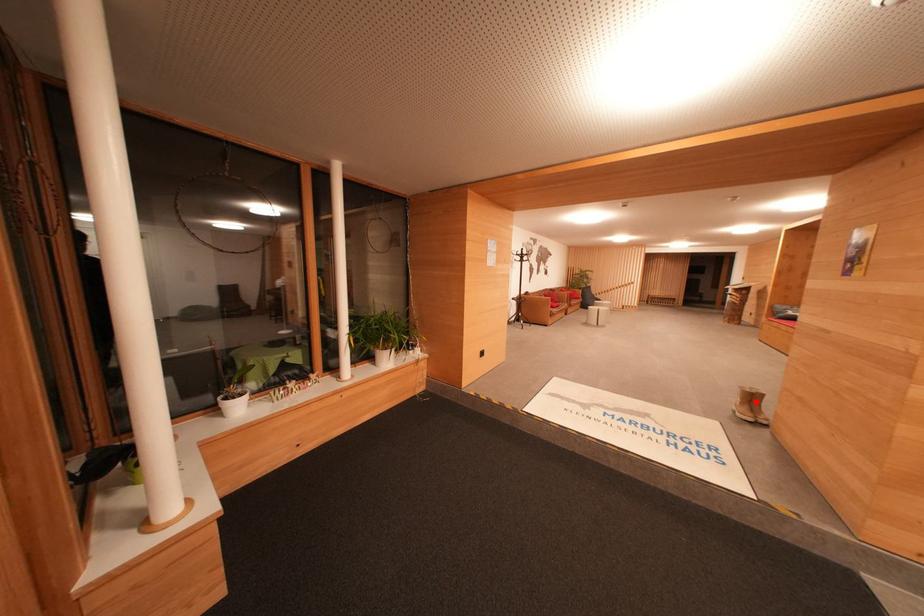
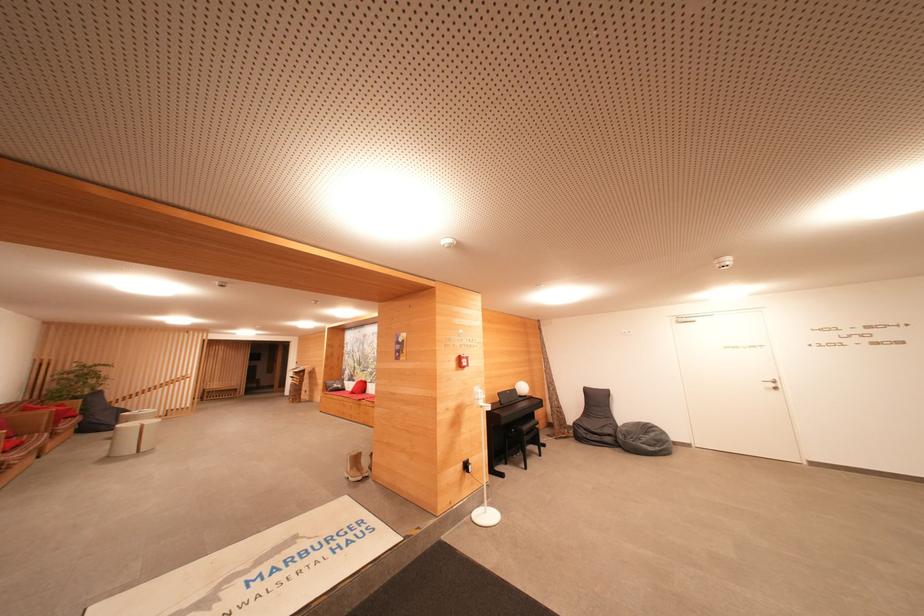
Where in the second image is the point corresponding to the highlighted location from the first image?

(359, 463)